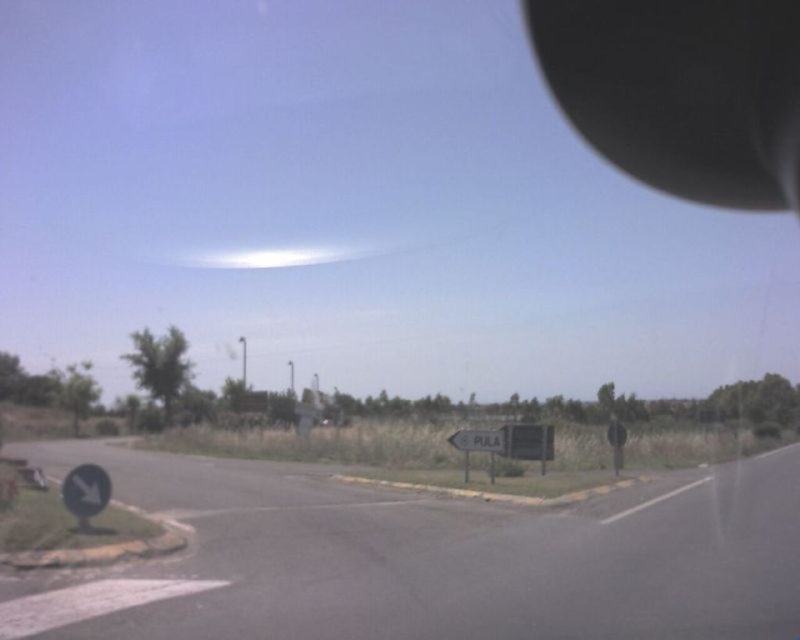
Question: Observing the image, what is the correct spatial positioning of black matte rearview mirror at upper right in reference to white plastic sign at center?

Choices:
 (A) above
 (B) below

Answer: (A)

Question: Can you confirm if black matte rearview mirror at upper right is positioned to the right of white plastic sign at center?

Choices:
 (A) yes
 (B) no

Answer: (A)

Question: Is black matte rearview mirror at upper right in front of white plastic sign at center?

Choices:
 (A) no
 (B) yes

Answer: (A)

Question: Which point appears farthest from the camera in this image?

Choices:
 (A) (790, 92)
 (B) (490, 444)

Answer: (A)

Question: Which object appears farthest from the camera in this image?

Choices:
 (A) black matte rearview mirror at upper right
 (B) white plastic sign at center

Answer: (A)